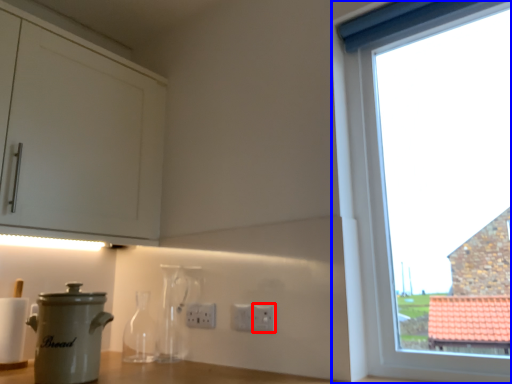
Question: Which point is further to the camera, electric outlet (highlighted by a red box) or window (highlighted by a blue box)?

Choices:
 (A) electric outlet
 (B) window

Answer: (A)